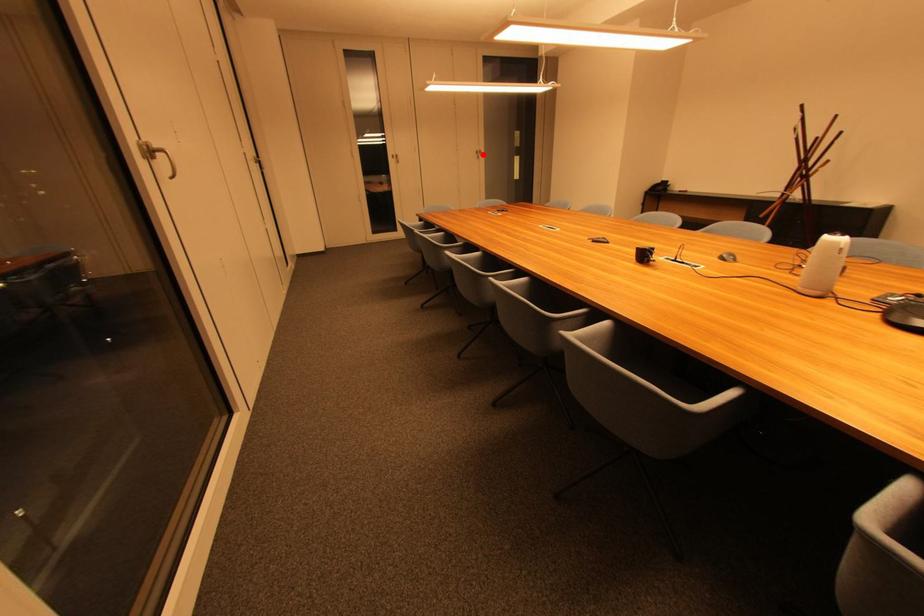
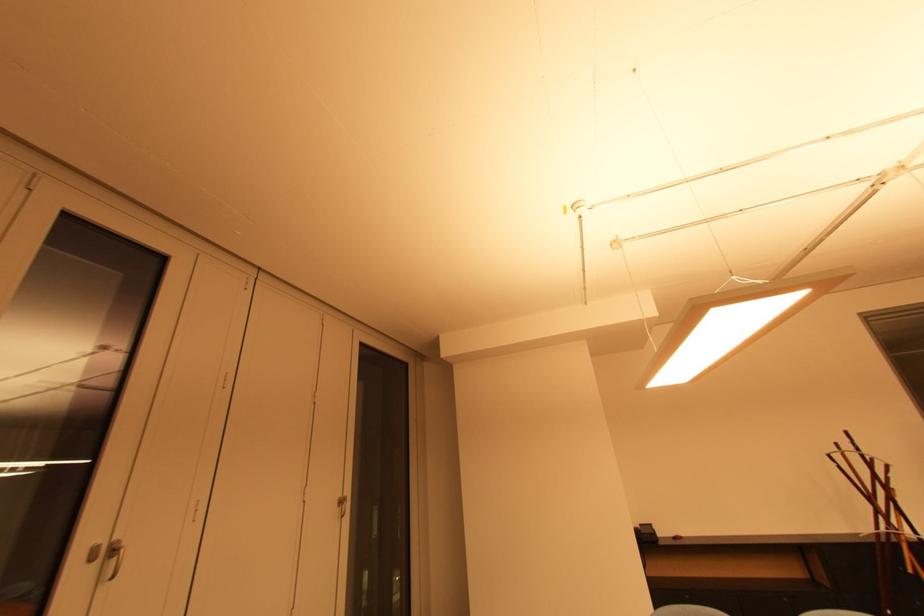
Where in the second image is the point corresponding to the highlighted location from the first image?

(346, 504)